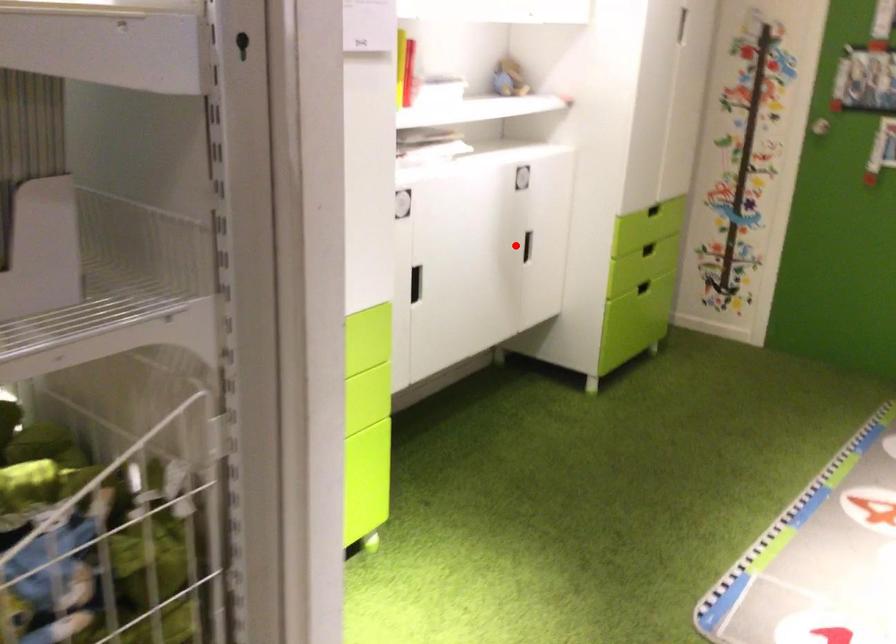
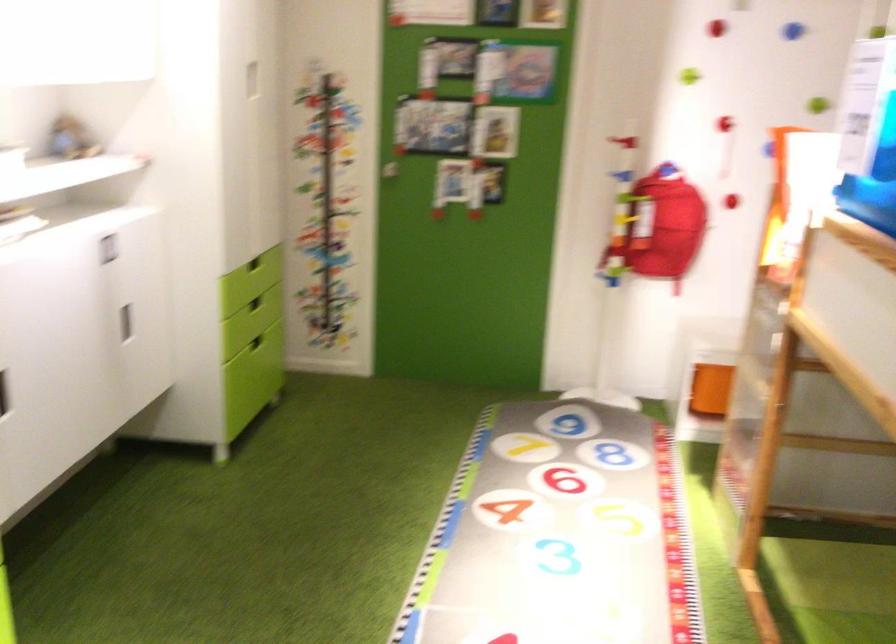
Question: A red point is marked in image1. In image2, is the corresponding 3D point closer to the camera or farther? Reply with the corresponding letter.

Choices:
 (A) The corresponding 3D point is closer.
 (B) The corresponding 3D point is farther.

Answer: (A)